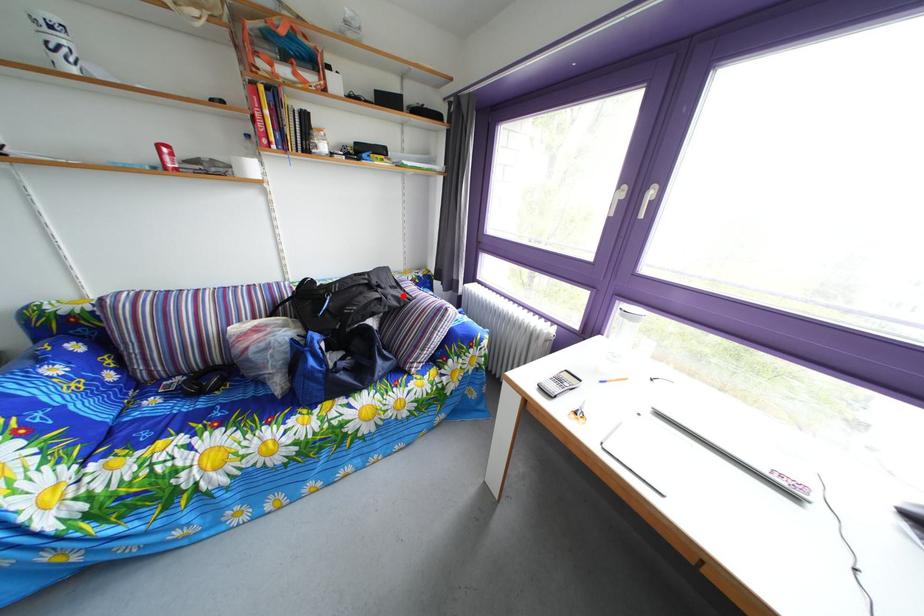
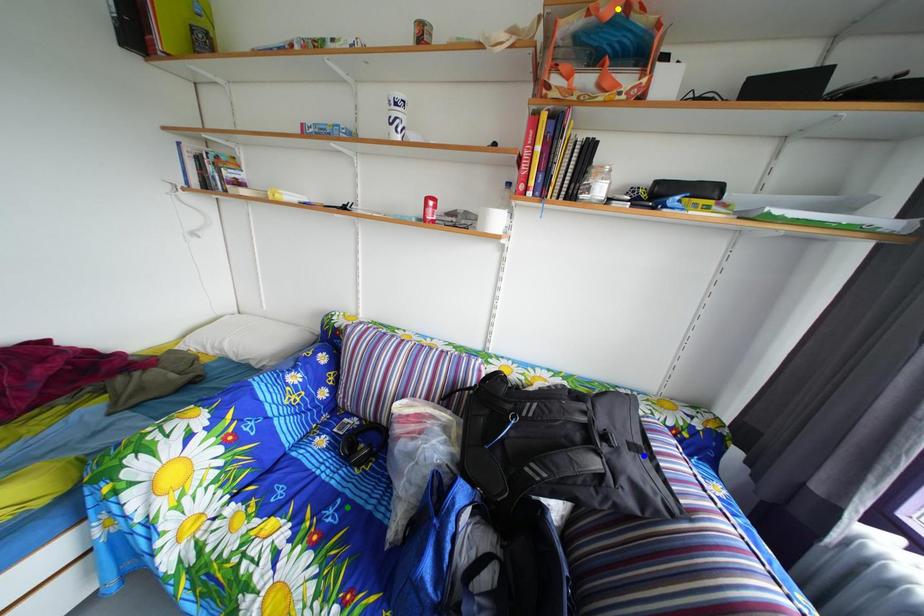
Question: I am providing you with two images of the same scene from different viewpoints. A red point is marked on the first image. You are given multiple points on the second image. Which mark in image 2 goes with the point in image 1?

Choices:
 (A) blue point
 (B) green point
 (C) yellow point

Answer: (A)